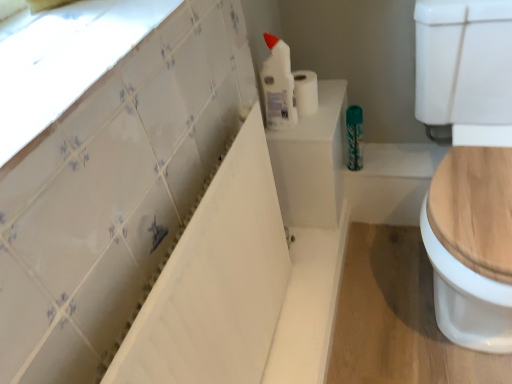
Question: From their relative heights in the image, would you say teal metallic can at center is taller or shorter than white glossy bathtub at upper left?

Choices:
 (A) tall
 (B) short

Answer: (B)

Question: Considering the positions of teal metallic can at center and white glossy bathtub at upper left in the image, is teal metallic can at center wider or thinner than white glossy bathtub at upper left?

Choices:
 (A) wide
 (B) thin

Answer: (B)

Question: Considering the real-world distances, which object is closest to the white glossy bathtub at upper left?

Choices:
 (A) white glossy bottle at upper center
 (B) teal metallic can at center
 (C) white glossy tile at upper left
 (D) white matte toilet paper at upper center

Answer: (C)

Question: Estimate the real-world distances between objects in this image. Which object is farther from the white glossy bathtub at upper left?

Choices:
 (A) white glossy bottle at upper center
 (B) white glossy tile at upper left
 (C) white matte toilet paper at upper center
 (D) teal metallic can at center

Answer: (D)